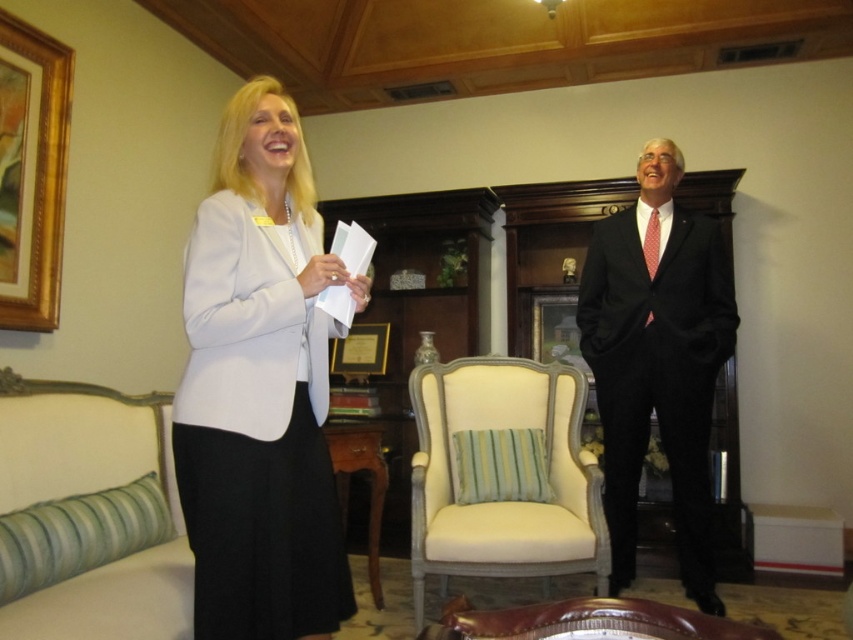
You are a photographer setting up for a portrait shoot in the office scene. The subject is standing near the green striped fabric armchair at lower left. You want to position your camera so that it is exactly 1.50 meters away from the chair. Based on the scene description, is the current camera position already set to the correct distance?

Yes, the camera is already positioned exactly 1.50 meters away from the green striped fabric armchair at lower left, as stated in the object description.